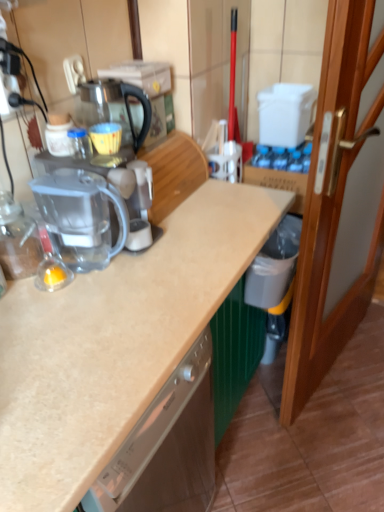
At what (x,y) coordinates should I click in order to perform the action: click on free space in front of wooden door at right. Please return your answer as a coordinate pair (x, y). This screenshot has width=384, height=512. Looking at the image, I should click on (337, 445).